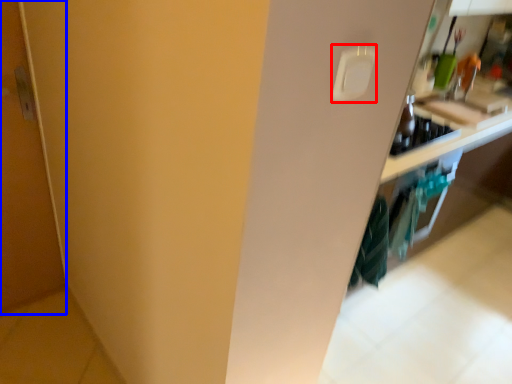
Question: Which object is further to the camera taking this photo, light switch (highlighted by a red box) or door (highlighted by a blue box)?

Choices:
 (A) light switch
 (B) door

Answer: (B)